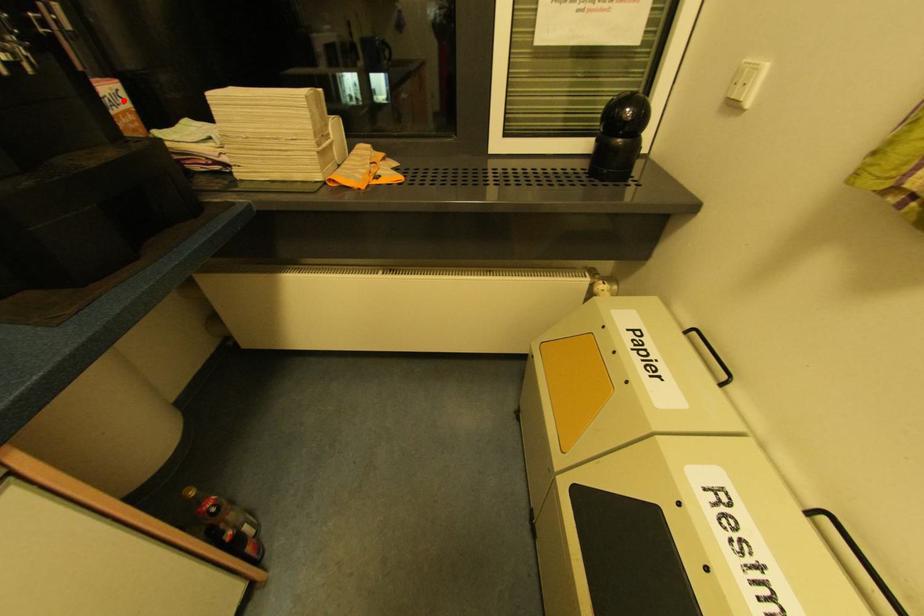
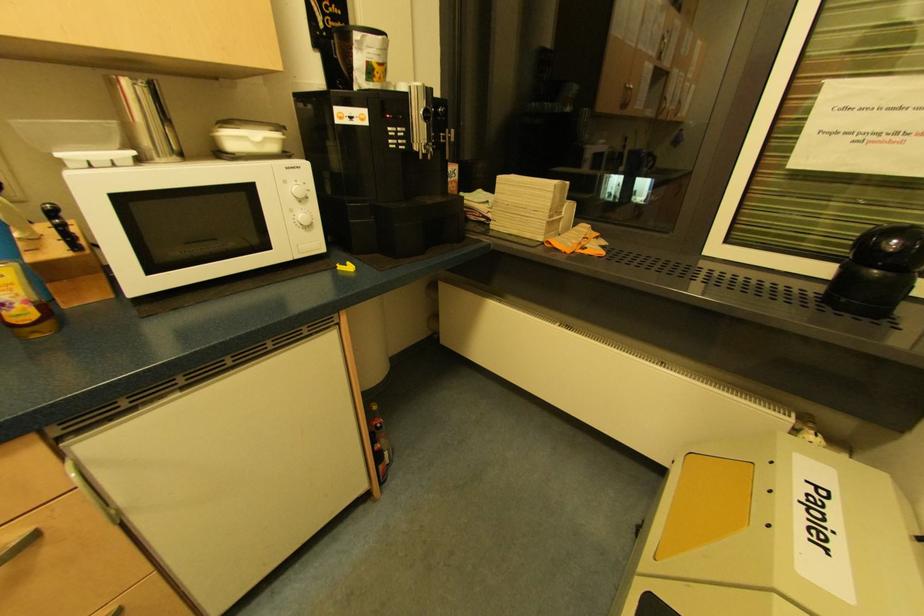
Question: I am providing you with two images of the same scene from different viewpoints. A red point is marked on the first image. Can you still see the location of the red point in image 2?

Choices:
 (A) Yes
 (B) No

Answer: (A)